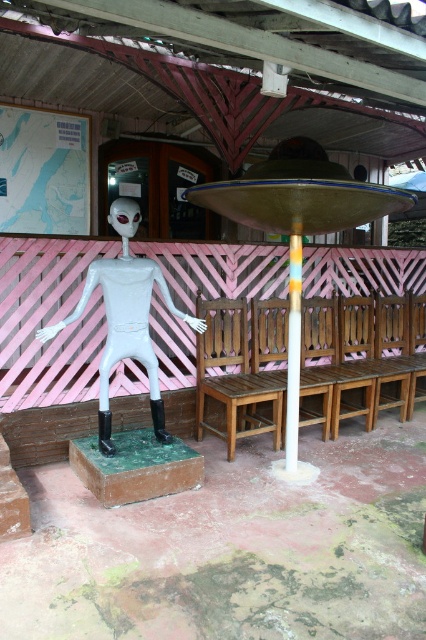
You are planning to place a new bench in the seating area. The bench is 1.2 meters wide. There is space between the white matte alien at left and the multicolored striped pole at center. Can the bench fit in that space?

The white matte alien at left might be wider than the multicolored striped pole at center, so the space between them may not be wide enough to accommodate a 1.2 meter bench. Check the actual width before placing the bench.

You are standing at the center of the outdoor seating area and want to place a new decorative statue exactly at the point marked by the coordinates point (124, 317). What object is currently located at that point?

The point (124, 317) corresponds to the white matte alien at left, so placing the statue there would require moving the existing alien figure.